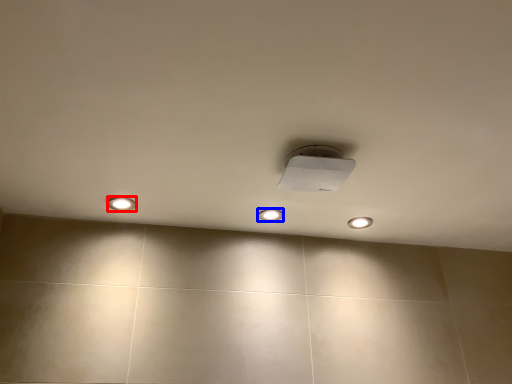
Question: Which object is further to the camera taking this photo, dot (highlighted by a red box) or dot (highlighted by a blue box)?

Choices:
 (A) dot
 (B) dot

Answer: (B)